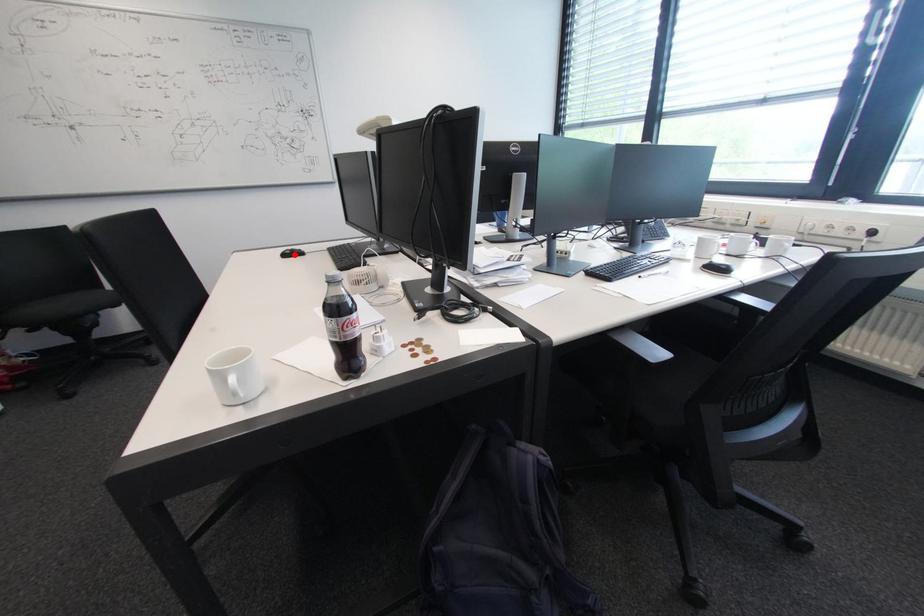
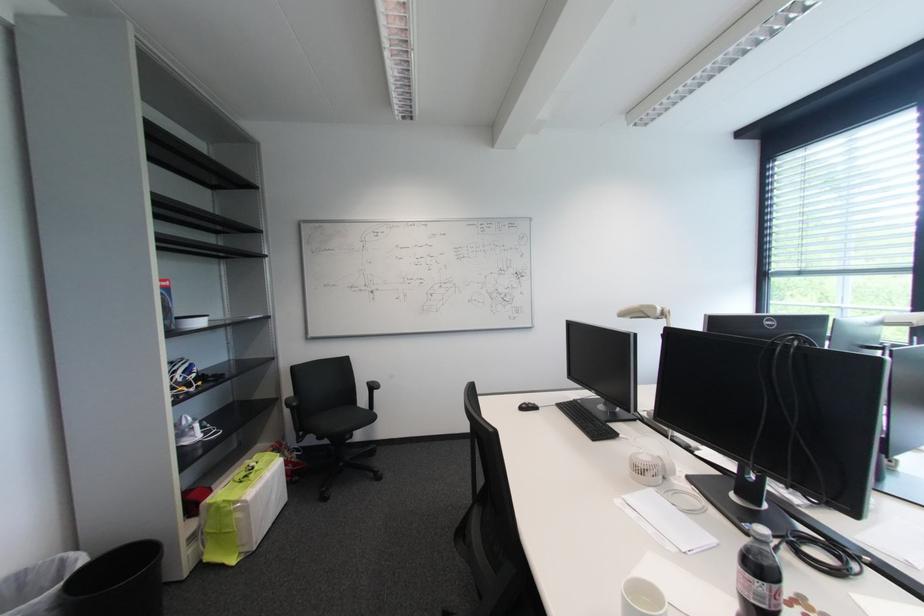
Where in the second image is the point corresponding to the highlighted location from the first image?

(530, 408)